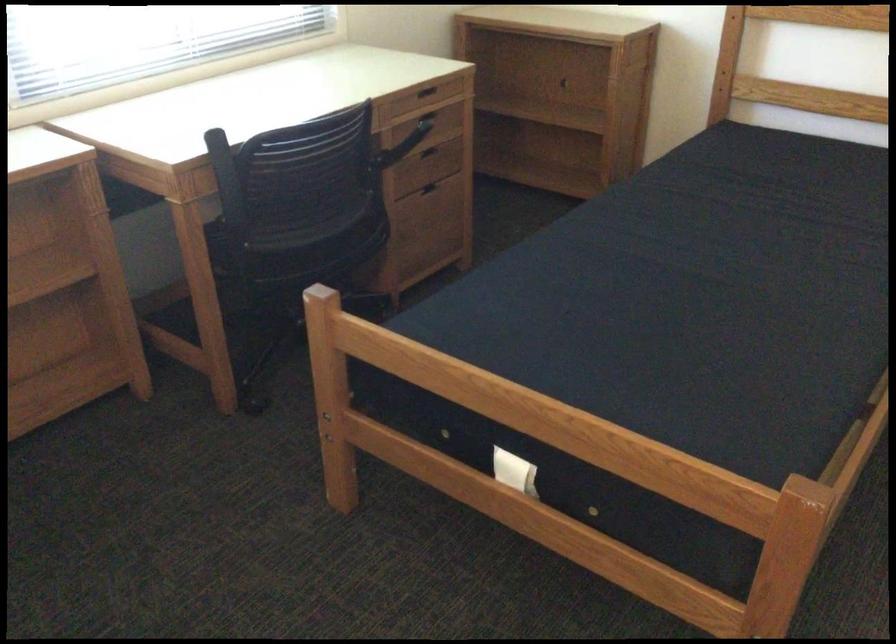
Identify the location of black chair armrest. Image resolution: width=896 pixels, height=644 pixels. (227, 182).